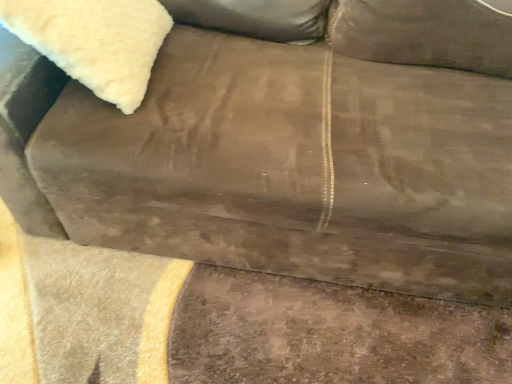
The height and width of the screenshot is (384, 512). Identify the location of white fluffy pillow at upper left. (95, 41).

Describe the element at coordinates (95, 41) in the screenshot. I see `white fluffy pillow at upper left` at that location.

I want to click on white fluffy pillow at upper left, so click(95, 41).